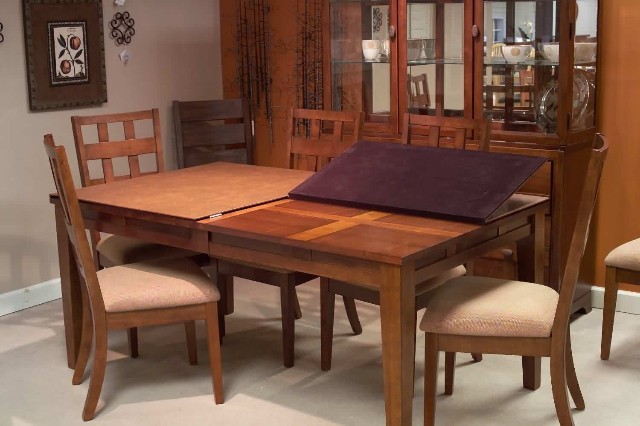
The height and width of the screenshot is (426, 640). Find the location of `top side of foldable table cover`. top side of foldable table cover is located at coordinates (518, 205), (227, 175), (184, 187).